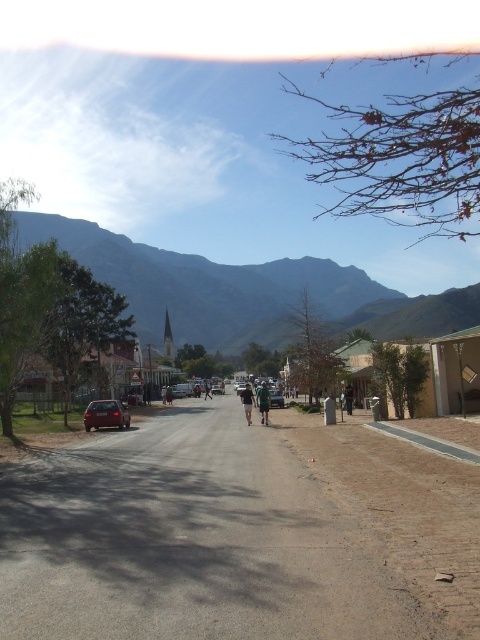
Looking at this image, who is higher up, dark gray fabric pants at center or metallic silver car at center?

Positioned higher is metallic silver car at center.

Is point (250, 416) positioned before point (279, 406)?

Yes, it is in front of point (279, 406).

Where is `dark gray fabric pants at center`? dark gray fabric pants at center is located at coordinates (247, 403).

Does point (124, 417) come in front of point (276, 400)?

Yes, it is in front of point (276, 400).

Can you confirm if matte red car at left is smaller than metallic silver car at center?

Correct, matte red car at left occupies less space than metallic silver car at center.

Where is `matte red car at left`? matte red car at left is located at coordinates (106, 413).

Find the location of a particular element. The width and height of the screenshot is (480, 640). green fabric shirt at center is located at coordinates (264, 401).

Which is behind, point (265, 408) or point (351, 401)?

The point (351, 401) is more distant.

Find the location of a particular element. green fabric shirt at center is located at coordinates (264, 401).